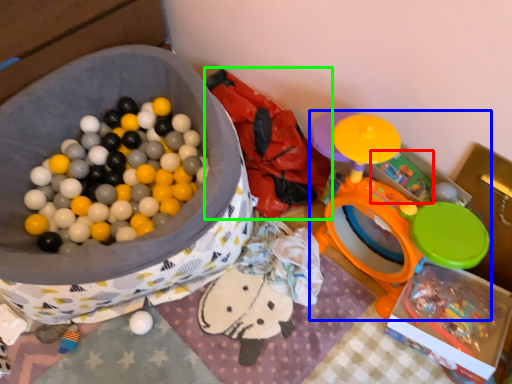
Question: Based on their relative distances, which object is nearer to toy (highlighted by a red box)? Choose from toy (highlighted by a blue box) and bean bag chair (highlighted by a green box).

Choices:
 (A) toy
 (B) bean bag chair

Answer: (A)